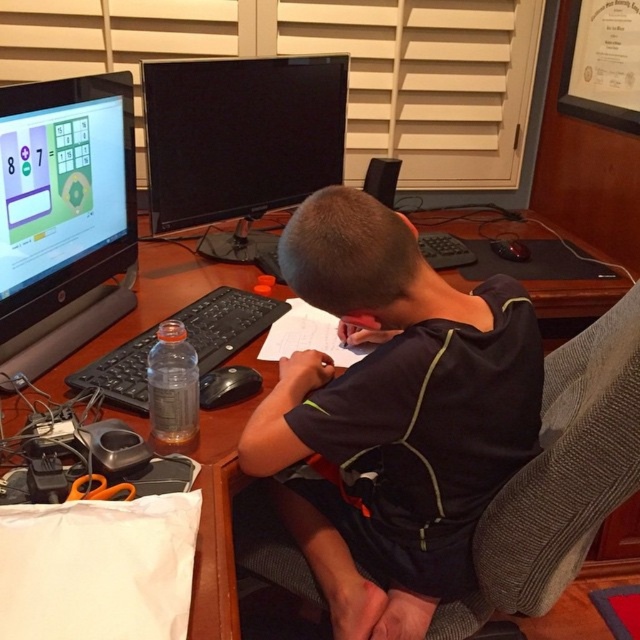
Is point (280, 413) closer to camera compared to point (214, 579)?

No, it is behind (214, 579).

Who is more forward, (346, 257) or (214, 630)?

Point (214, 630) is more forward.

Where is `dark blue jersey at center`? Image resolution: width=640 pixels, height=640 pixels. dark blue jersey at center is located at coordinates (394, 416).

Locate an element on the screen. dark blue jersey at center is located at coordinates pos(394,416).

Does black glossy monitor at center have a lesser width compared to brown wooden computer desk at center?

No.

Is black glossy monitor at center positioned behind brown wooden computer desk at center?

Yes, black glossy monitor at center is behind brown wooden computer desk at center.

The width and height of the screenshot is (640, 640). I want to click on black glossy monitor at center, so coord(240,141).

Does black glossy monitor at center have a greater width compared to black plastic keyboard at center?

Correct, the width of black glossy monitor at center exceeds that of black plastic keyboard at center.

Is point (150, 92) positioned behind point (260, 332)?

Yes, it is.

The width and height of the screenshot is (640, 640). What do you see at coordinates (240, 141) in the screenshot? I see `black glossy monitor at center` at bounding box center [240, 141].

Locate an element on the screen. The width and height of the screenshot is (640, 640). black glossy monitor at center is located at coordinates (240, 141).